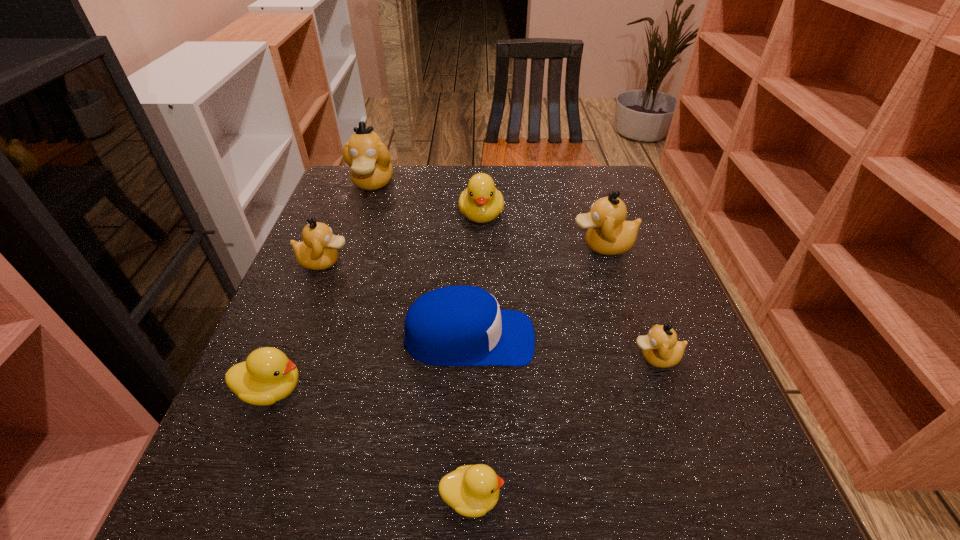
Locate an element on the screen. vacant space located on the face of the smallest tan duckling is located at coordinates (533, 357).

I want to click on free spot located on the face of the smallest tan duckling, so click(x=506, y=357).

Find the location of a particular element. Image resolution: width=960 pixels, height=540 pixels. free space located on the face of the smallest tan duckling is located at coordinates (462, 357).

Identify the location of vacant area situated on the beak of the shortest duckling. The width and height of the screenshot is (960, 540). (762, 497).

Find the location of a particular element. object that is at the near edge is located at coordinates (471, 490).

Identify the location of object present at the far left corner. This screenshot has height=540, width=960. (370, 168).

The height and width of the screenshot is (540, 960). What are the coordinates of `vacant region at the far edge of the desktop` in the screenshot? It's located at (388, 210).

This screenshot has height=540, width=960. In the image, there is a desktop. What are the coordinates of `blank space at the near edge` in the screenshot? It's located at (336, 492).

The width and height of the screenshot is (960, 540). I want to click on blank space at the left edge of the desktop, so click(310, 282).

Image resolution: width=960 pixels, height=540 pixels. Identify the location of vacant space at the right edge. (647, 235).